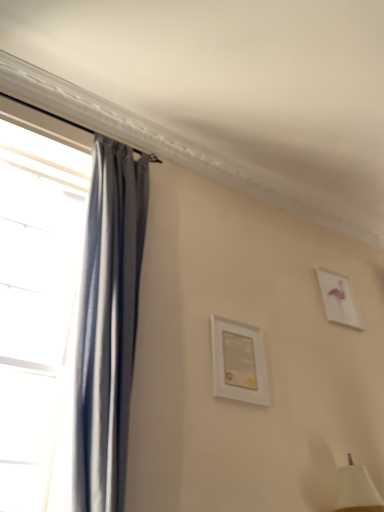
Question: From a real-world perspective, is white glossy picture frame at upper right, which ranks as the 2th picture frame in left-to-right order, above or below white matte picture frame at center, the first picture frame viewed from the left?

Choices:
 (A) below
 (B) above

Answer: (B)

Question: Looking at their shapes, would you say white glossy picture frame at upper right, which ranks as the 2th picture frame in left-to-right order, is wider or thinner than white matte picture frame at center, which is the 2th picture frame in back-to-front order?

Choices:
 (A) thin
 (B) wide

Answer: (A)

Question: Estimate the real-world distances between objects in this image. Which object is closer to the white matte picture frame at center, marked as the first picture frame in a front-to-back arrangement?

Choices:
 (A) white glossy picture frame at upper right, which ranks as the 2th picture frame in left-to-right order
 (B) matte gray curtain at left

Answer: (B)

Question: Considering the real-world distances, which object is closest to the matte gray curtain at left?

Choices:
 (A) white glossy picture frame at upper right, the second picture frame in the front-to-back sequence
 (B) white matte picture frame at center, the 2th picture frame when ordered from right to left

Answer: (B)